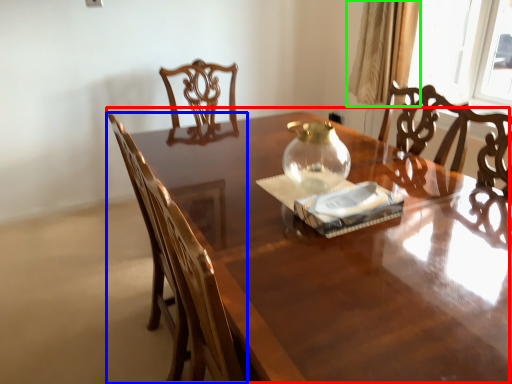
Question: Based on their relative distances, which object is nearer to table (highlighted by a red box)? Choose from chair (highlighted by a blue box) and curtain (highlighted by a green box).

Choices:
 (A) chair
 (B) curtain

Answer: (A)